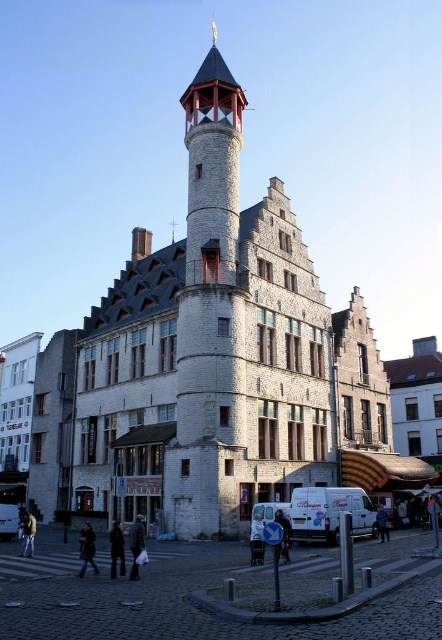
Between dark brown leather coat at lower left and dark blue fabric jacket at lower center, which one has less height?

Standing shorter between the two is dark blue fabric jacket at lower center.

Is point (94, 532) less distant than point (376, 518)?

Yes, it is.

Identify the location of dark brown leather coat at lower left. (87, 548).

Which is below, light brown leather jacket at lower left or dark blue fabric jacket at lower center?

light brown leather jacket at lower left is lower down.

Image resolution: width=442 pixels, height=640 pixels. Find the location of `light brown leather jacket at lower left`. light brown leather jacket at lower left is located at coordinates (27, 534).

Can you confirm if dark brown leather coat at lower center is positioned above light brown leather jacket at lower left?

Yes, dark brown leather coat at lower center is above light brown leather jacket at lower left.

Between dark brown leather coat at lower center and light brown leather jacket at lower left, which one is positioned lower?

light brown leather jacket at lower left is lower down.

Find the location of a particular element. Image resolution: width=442 pixels, height=640 pixels. dark brown leather coat at lower center is located at coordinates (117, 548).